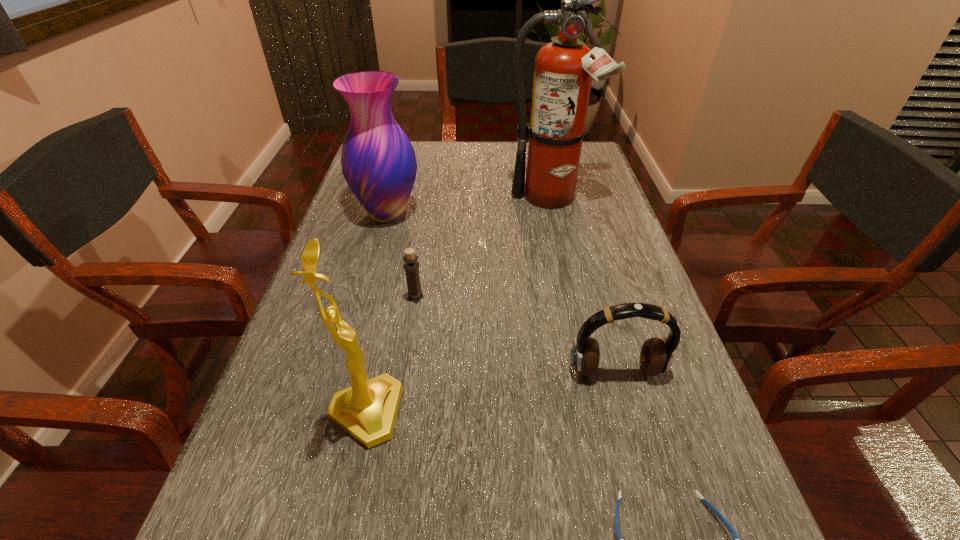
In order to click on vacant space in between the headset and the candle holder in this screenshot , I will do `click(516, 334)`.

Where is `vacant space that's between the vase and the candle holder`? This screenshot has width=960, height=540. vacant space that's between the vase and the candle holder is located at coordinates (401, 255).

Find the location of a particular element. vacant space that is in between the fire extinguisher and the headset is located at coordinates (583, 286).

You are a GUI agent. You are given a task and a screenshot of the screen. Output one action in this format:
    pyautogui.click(x=<x>, y=<y>)
    Task: Click on the free point between the fire extinguisher and the award
    The height and width of the screenshot is (540, 960).
    Given the screenshot: What is the action you would take?
    pyautogui.click(x=458, y=307)

You are a GUI agent. You are given a task and a screenshot of the screen. Output one action in this format:
    pyautogui.click(x=<x>, y=<y>)
    Task: Click on the free spot between the award and the vase
    The width and height of the screenshot is (960, 540).
    Given the screenshot: What is the action you would take?
    pyautogui.click(x=376, y=313)

Find the location of a particular element. This screenshot has height=540, width=960. free space between the tallest object and the fifth tallest object is located at coordinates (483, 249).

Where is `empty space that is in between the vase and the headset`? The image size is (960, 540). empty space that is in between the vase and the headset is located at coordinates (502, 292).

Where is `vacant space that's between the award and the tallest object`? This screenshot has height=540, width=960. vacant space that's between the award and the tallest object is located at coordinates (458, 307).

Select which object is the closest to the shortest object. Please provide its 2D coordinates. Your answer should be formatted as a tuple, i.e. [(x, y)], where the tuple contains the x and y coordinates of a point satisfying the conditions above.

[(656, 356)]

Identify which object is the third closest to the award. Please provide its 2D coordinates. Your answer should be formatted as a tuple, i.e. [(x, y)], where the tuple contains the x and y coordinates of a point satisfying the conditions above.

[(733, 533)]